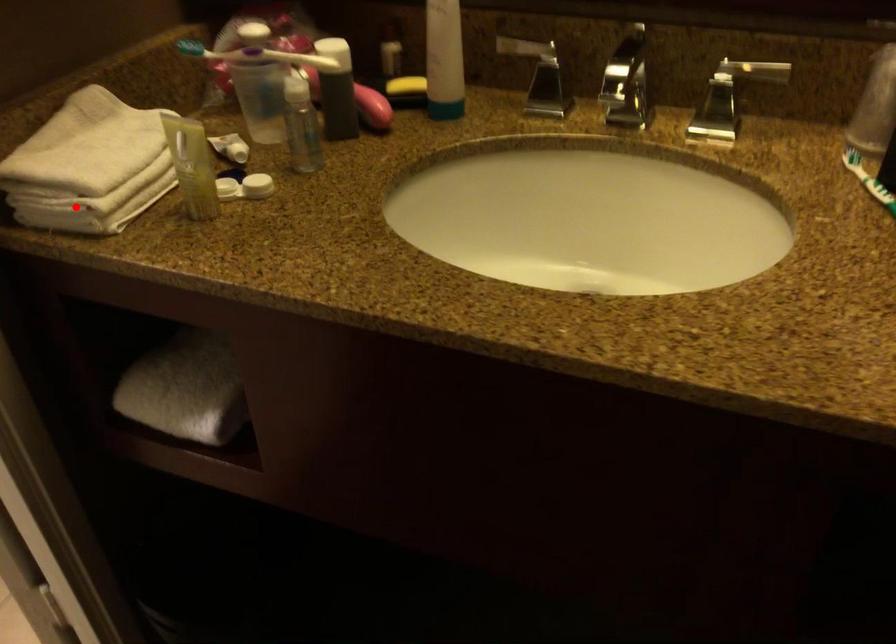
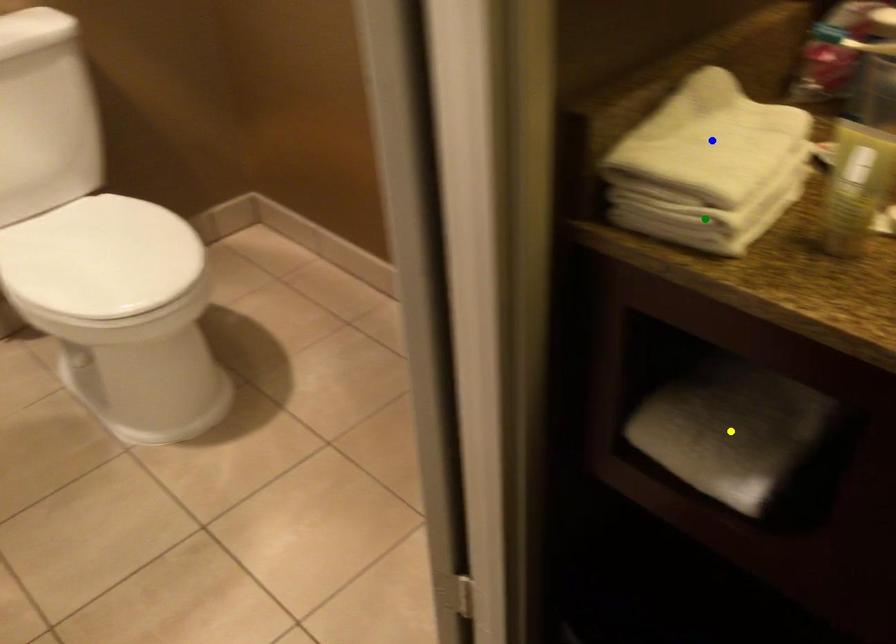
Question: I am providing you with two images of the same scene from different viewpoints. A red point is marked on the first image. You are given multiple points on the second image. Can you choose the point in image 2 that corresponds to the point in image 1?

Choices:
 (A) blue point
 (B) green point
 (C) yellow point

Answer: (B)